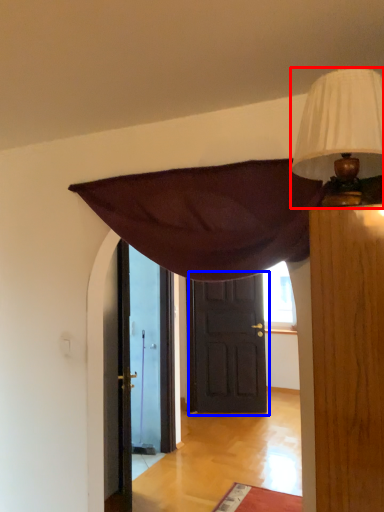
Question: Which object is closer to the camera taking this photo, lamp (highlighted by a red box) or door (highlighted by a blue box)?

Choices:
 (A) lamp
 (B) door

Answer: (A)